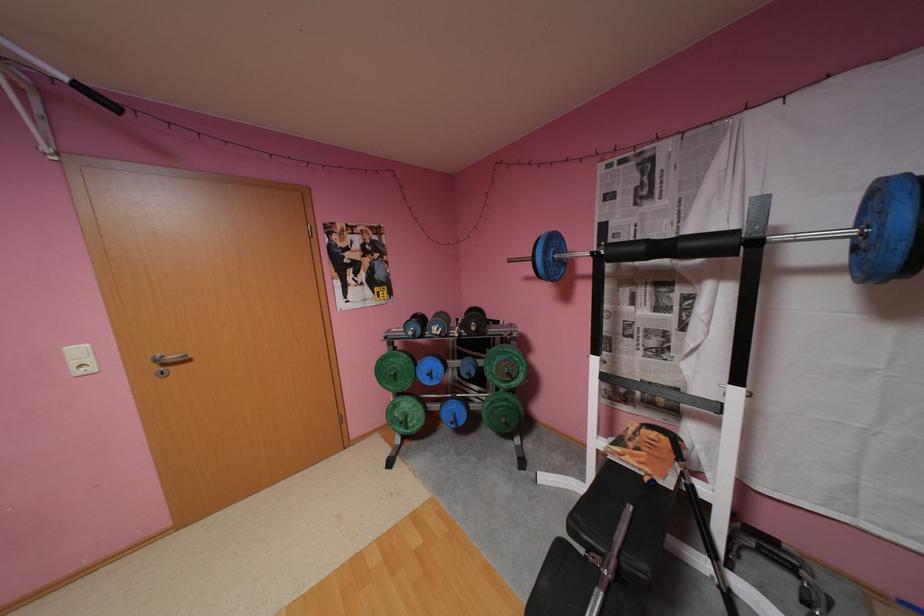
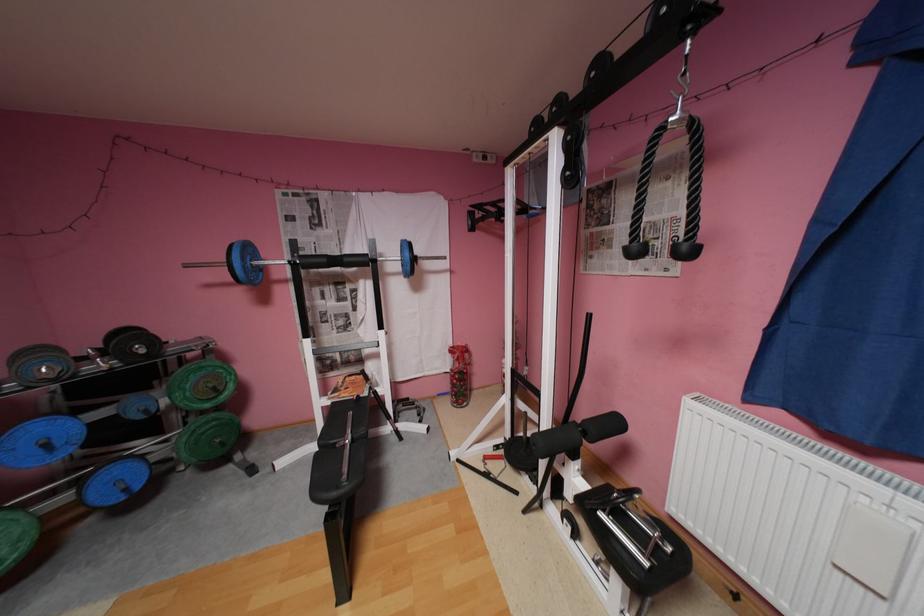
The point at (517, 374) is marked in the first image. Where is the corresponding point in the second image?

(224, 387)